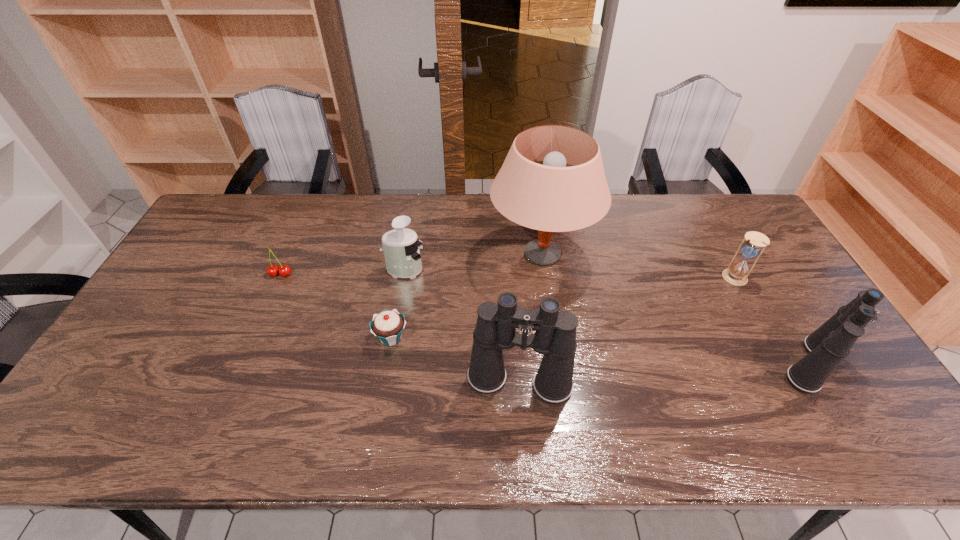
The height and width of the screenshot is (540, 960). Identify the location of free space between the taller binoculars and the third tallest object. (665, 373).

Find the location of `blank region between the shorter binoculars and the cupcake`. blank region between the shorter binoculars and the cupcake is located at coordinates (601, 351).

Identify the location of vacant region between the leftmost object and the hourglass. Image resolution: width=960 pixels, height=540 pixels. (507, 276).

Locate an element on the screen. free space between the hourglass and the leftmost object is located at coordinates (507, 276).

In order to click on free spot between the juicer and the leftmost object in this screenshot , I will do `click(343, 272)`.

Locate an element on the screen. empty space between the hourglass and the fifth shortest object is located at coordinates (772, 321).

Locate an element on the screen. The width and height of the screenshot is (960, 540). object that is the closest to the left binoculars is located at coordinates (388, 326).

Locate an element on the screen. object identified as the third closest to the left binoculars is located at coordinates pos(402,255).

At what (x,y) coordinates should I click in order to perform the action: click on free location that satisfies the following two spatial constraints: 1. on the front-facing side of the lampshade; 2. on the back side of the third tallest object. Please return your answer as a coordinate pair (x, y). Looking at the image, I should click on (558, 364).

At what (x,y) coordinates should I click in order to perform the action: click on vacant area in the image that satisfies the following two spatial constraints: 1. on the back side of the third tallest object; 2. on the front-facing side of the tallest object. Please return your answer as a coordinate pair (x, y). Looking at the image, I should click on (744, 254).